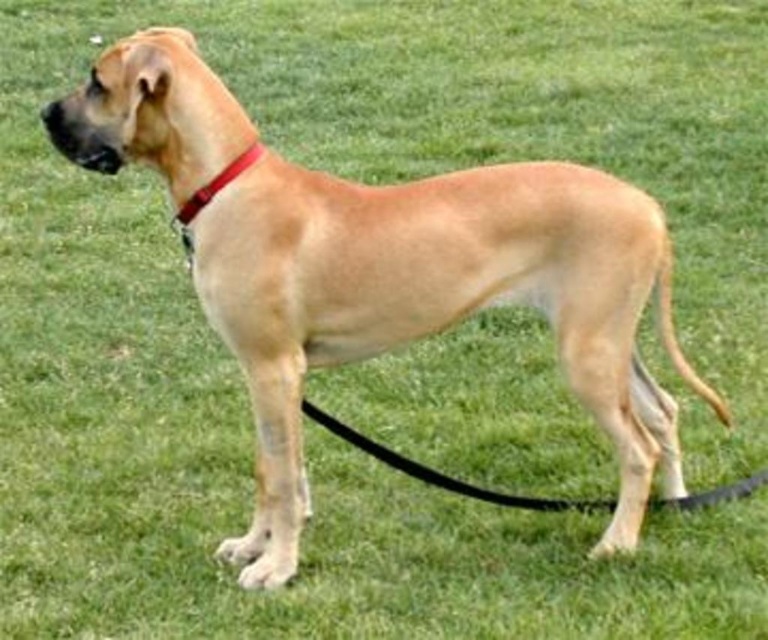
Between black rubber leash at lower center and red leather collar at upper left, which one has less height?

Standing shorter between the two is red leather collar at upper left.

Between point (613, 499) and point (207, 202), which one is positioned behind?

The point (613, 499) is more distant.

Who is more distant from viewer, (425,465) or (204,200)?

Positioned behind is point (425,465).

Where is `black rubber leash at lower center`? This screenshot has width=768, height=640. black rubber leash at lower center is located at coordinates (442, 474).